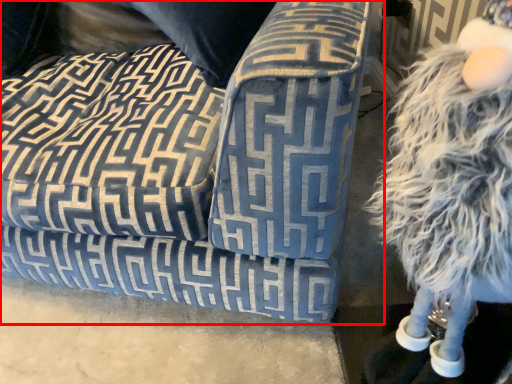
Question: From the image's perspective, what is the correct spatial positioning of studio couch (annotated by the red box) in reference to figurine?

Choices:
 (A) above
 (B) below

Answer: (A)